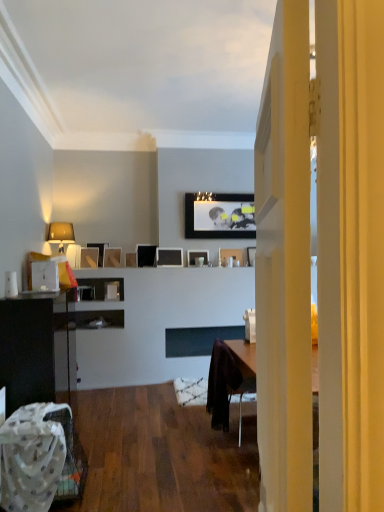
Question: Is matte black picture frame at upper center, which appears as the 6th picture frame when viewed from the right, thinner than matte black picture frame at upper center, which appears as the third picture frame when viewed from the left?

Choices:
 (A) no
 (B) yes

Answer: (B)

Question: Is matte black picture frame at upper center, the fifth picture frame viewed from the left, wider than matte black picture frame at upper center, which is the 8th picture frame from right to left?

Choices:
 (A) no
 (B) yes

Answer: (A)

Question: From the image's perspective, is matte black picture frame at upper center, the fifth picture frame viewed from the left, over matte black picture frame at upper center, which is the 8th picture frame from right to left?

Choices:
 (A) yes
 (B) no

Answer: (A)

Question: From a real-world perspective, is matte black picture frame at upper center, the fifth picture frame viewed from the left, positioned under matte black picture frame at upper center, which is the 8th picture frame from right to left, based on gravity?

Choices:
 (A) no
 (B) yes

Answer: (A)

Question: Can you confirm if matte black picture frame at upper center, the fifth picture frame viewed from the left, is positioned to the right of matte black picture frame at upper center, which is the 8th picture frame from right to left?

Choices:
 (A) no
 (B) yes

Answer: (B)

Question: From the image's perspective, relative to matte black picture frame at upper center, the fifth picture frame viewed from the left, is matte black picture frame at upper center, the 6th picture frame positioned from the left, above or below?

Choices:
 (A) above
 (B) below

Answer: (B)

Question: From their relative heights in the image, would you say matte black picture frame at upper center, the 6th picture frame positioned from the left, is taller or shorter than matte black picture frame at upper center, which appears as the 6th picture frame when viewed from the right?

Choices:
 (A) tall
 (B) short

Answer: (B)

Question: Looking at their shapes, would you say matte black picture frame at upper center, positioned as the 5th picture frame in right-to-left order, is wider or thinner than matte black picture frame at upper center, the fifth picture frame viewed from the left?

Choices:
 (A) thin
 (B) wide

Answer: (A)

Question: Choose the correct answer: Is matte black picture frame at upper center, the 6th picture frame positioned from the left, inside matte black picture frame at upper center, which appears as the 6th picture frame when viewed from the right, or outside it?

Choices:
 (A) outside
 (B) inside

Answer: (A)

Question: From a real-world perspective, is velvet dark brown swivel chair at center physically located above or below white fabric chair at lower left?

Choices:
 (A) below
 (B) above

Answer: (B)

Question: In terms of height, does velvet dark brown swivel chair at center look taller or shorter compared to white fabric chair at lower left?

Choices:
 (A) short
 (B) tall

Answer: (B)

Question: Is velvet dark brown swivel chair at center bigger or smaller than white fabric chair at lower left?

Choices:
 (A) big
 (B) small

Answer: (A)

Question: Does point (223, 376) appear closer or farther from the camera than point (33, 407)?

Choices:
 (A) farther
 (B) closer

Answer: (A)

Question: Considering the relative positions of matte black picture frame at center, marked as the second picture frame in a left-to-right arrangement, and matte black cabinet at left in the image provided, is matte black picture frame at center, marked as the second picture frame in a left-to-right arrangement, to the left or to the right of matte black cabinet at left?

Choices:
 (A) right
 (B) left

Answer: (A)

Question: Does point (99, 248) appear closer or farther from the camera than point (48, 308)?

Choices:
 (A) farther
 (B) closer

Answer: (A)